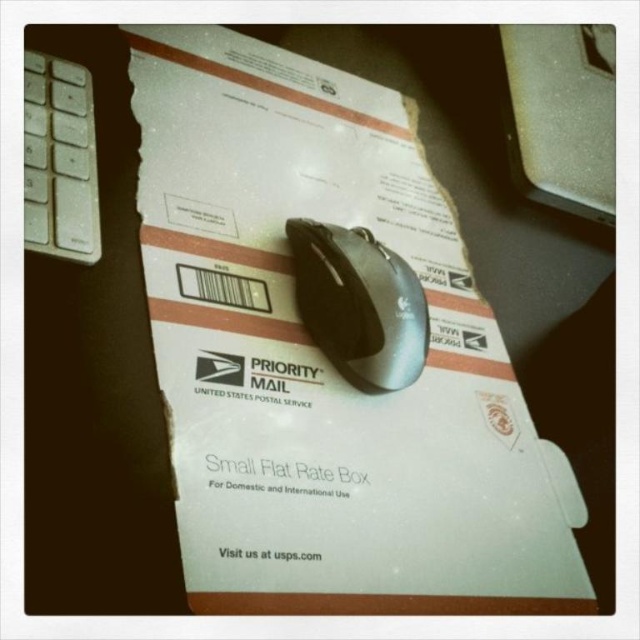
Question: Which point is farther from the camera taking this photo?

Choices:
 (A) (403, 272)
 (B) (58, 205)
 (C) (509, 156)

Answer: (C)

Question: Which of the following is the farthest from the observer?

Choices:
 (A) satin black mouse at center
 (B) metallic silver computer at upper right

Answer: (B)

Question: From the image, what is the correct spatial relationship of metallic silver computer at upper right in relation to white plastic keyboard at left?

Choices:
 (A) right
 (B) left

Answer: (A)

Question: Is metallic silver computer at upper right to the left of satin black mouse at center from the viewer's perspective?

Choices:
 (A) no
 (B) yes

Answer: (A)

Question: Which point appears closest to the camera in this image?

Choices:
 (A) (38, 193)
 (B) (378, 385)
 (C) (580, 83)

Answer: (A)

Question: Observing the image, what is the correct spatial positioning of metallic silver computer at upper right in reference to satin black mouse at center?

Choices:
 (A) right
 (B) left

Answer: (A)